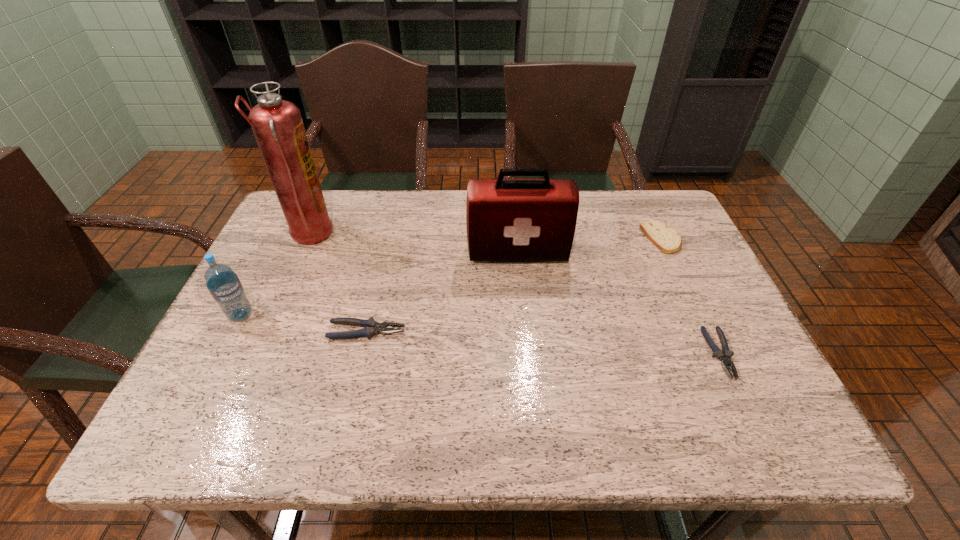
Identify the location of vacant space located on the side of the tallest object with the label. (361, 235).

In order to click on free location located on the side of the first aid kit with the cross symbol in this screenshot , I will do pos(521,287).

You are a GUI agent. You are given a task and a screenshot of the screen. Output one action in this format:
    pyautogui.click(x=<x>, y=<y>)
    Task: Click on the vacant space located on the front of the water bottle
    This screenshot has width=960, height=540.
    Given the screenshot: What is the action you would take?
    [217, 361]

Locate an element on the screen. The height and width of the screenshot is (540, 960). vacant space located on the back of the pita bread is located at coordinates (639, 193).

Find the location of a particular element. The height and width of the screenshot is (540, 960). fire extinguisher that is positioned at the far edge is located at coordinates (277, 124).

Where is `pita bread situated at the far edge`? The image size is (960, 540). pita bread situated at the far edge is located at coordinates (666, 239).

This screenshot has height=540, width=960. I want to click on object that is positioned at the near edge, so click(x=725, y=357).

At what (x,y) coordinates should I click in order to perform the action: click on fire extinguisher present at the left edge. Please return your answer as a coordinate pair (x, y). This screenshot has width=960, height=540. Looking at the image, I should click on (277, 124).

Locate an element on the screen. water bottle situated at the left edge is located at coordinates (223, 284).

Locate an element on the screen. pliers that is at the right edge is located at coordinates (725, 357).